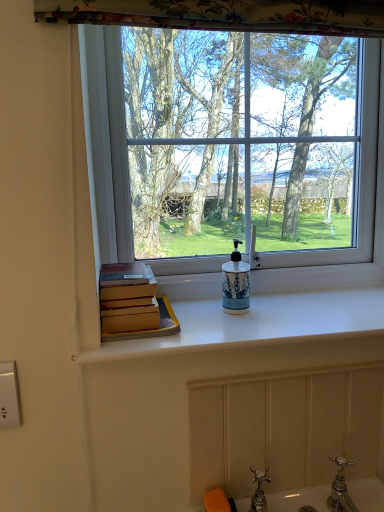
What do you see at coordinates (106, 140) in the screenshot? This screenshot has width=384, height=512. I see `transparent glass window at center` at bounding box center [106, 140].

I want to click on blue and white ceramic soap dispenser at center, so click(x=236, y=283).

What do you see at coordinates (133, 303) in the screenshot?
I see `hardcover books at left` at bounding box center [133, 303].

What do you see at coordinates (9, 396) in the screenshot?
I see `white plastic electric outlet at lower left` at bounding box center [9, 396].

Find the location of a particular element. This screenshot has width=384, height=512. transparent glass window at center is located at coordinates (106, 140).

Considering the sizes of white glossy counter top at center and transparent glass window at center in the image, is white glossy counter top at center bigger or smaller than transparent glass window at center?

Clearly, white glossy counter top at center is smaller in size than transparent glass window at center.

What's the angular difference between white glossy counter top at center and transparent glass window at center's facing directions?

The angular difference between white glossy counter top at center and transparent glass window at center is 0.00143 degrees.

Is white glossy counter top at center further to the viewer compared to transparent glass window at center?

No, it is in front of transparent glass window at center.

Which point is more forward, (153, 308) or (226, 279)?

The point (153, 308) is closer.

Does hardcover books at left have a lesser height compared to blue and white ceramic soap dispenser at center?

Yes, hardcover books at left is shorter than blue and white ceramic soap dispenser at center.

From the image's perspective, is hardcover books at left positioned above or below blue and white ceramic soap dispenser at center?

From the image's perspective, hardcover books at left appears below blue and white ceramic soap dispenser at center.

How distant is white plastic electric outlet at lower left from white glossy counter top at center?

The distance of white plastic electric outlet at lower left from white glossy counter top at center is 22.58 inches.

Which of these two, white plastic electric outlet at lower left or white glossy counter top at center, stands shorter?

Standing shorter between the two is white glossy counter top at center.

Is white plastic electric outlet at lower left not within white glossy counter top at center?

white plastic electric outlet at lower left is positioned outside white glossy counter top at center.

Which of these two, white plastic electric outlet at lower left or white glossy counter top at center, is bigger?

With larger size is white glossy counter top at center.

Is blue and white ceramic soap dispenser at center positioned behind hardcover books at left?

Yes, blue and white ceramic soap dispenser at center is further from the camera.

Considering the relative positions of blue and white ceramic soap dispenser at center and hardcover books at left in the image provided, is blue and white ceramic soap dispenser at center to the right of hardcover books at left from the viewer's perspective?

Yes, blue and white ceramic soap dispenser at center is to the right of hardcover books at left.

Which is behind, point (244, 289) or point (107, 330)?

The point (244, 289) is more distant.

Is blue and white ceramic soap dispenser at center looking in the opposite direction of hardcover books at left?

blue and white ceramic soap dispenser at center does not have its back to hardcover books at left.

Is transparent glass window at center taller or shorter than white plastic electric outlet at lower left?

Clearly, transparent glass window at center is taller compared to white plastic electric outlet at lower left.

Does transparent glass window at center have a greater width compared to white plastic electric outlet at lower left?

Correct, the width of transparent glass window at center exceeds that of white plastic electric outlet at lower left.

Could white plastic electric outlet at lower left be considered to be inside transparent glass window at center?

No, white plastic electric outlet at lower left is not surrounded by transparent glass window at center.

Which is closer to the camera, (x=173, y=330) or (x=113, y=257)?

Positioned in front is point (x=173, y=330).

Are hardcover books at left and transparent glass window at center located far from each other?

No, hardcover books at left is not far away from transparent glass window at center.

From the image's perspective, between hardcover books at left and transparent glass window at center, which one is located above?

transparent glass window at center is shown above in the image.

Is hardcover books at left at the left side of transparent glass window at center?

Yes.

Measure the distance between transparent glass window at center and hardcover books at left.

transparent glass window at center is 11.02 inches from hardcover books at left.

Could you tell me if transparent glass window at center is turned towards hardcover books at left?

Yes, transparent glass window at center is oriented towards hardcover books at left.

This screenshot has height=512, width=384. In order to click on book in front of the transparent glass window at center in this screenshot , I will do `click(133, 303)`.

Does transparent glass window at center have a smaller size compared to hardcover books at left?

Actually, transparent glass window at center might be larger than hardcover books at left.

The width and height of the screenshot is (384, 512). I want to click on counter top directly beneath the transparent glass window at center (from a real-world perspective), so click(x=259, y=324).

Identify the location of soap dispenser located above the hardcover books at left (from the image's perspective). (236, 283).

When comparing their distances from hardcover books at left, does white plastic electric outlet at lower left or white glossy counter top at center seem further?

white plastic electric outlet at lower left is positioned further to the anchor hardcover books at left.

Considering their positions, is white plastic electric outlet at lower left positioned closer to white glossy counter top at center than transparent glass window at center?

The object closer to white glossy counter top at center is transparent glass window at center.

Looking at this image, when comparing their distances from transparent glass window at center, does white plastic electric outlet at lower left or hardcover books at left seem further?

Based on the image, white plastic electric outlet at lower left appears to be further to transparent glass window at center.

Based on their spatial positions, is hardcover books at left or blue and white ceramic soap dispenser at center closer to white plastic electric outlet at lower left?

Among the two, hardcover books at left is located nearer to white plastic electric outlet at lower left.

Based on their spatial positions, is transparent glass window at center or hardcover books at left further from blue and white ceramic soap dispenser at center?

Based on the image, transparent glass window at center appears to be further to blue and white ceramic soap dispenser at center.

Based on their spatial positions, is white glossy counter top at center or white plastic electric outlet at lower left further from hardcover books at left?

Among the two, white plastic electric outlet at lower left is located further to hardcover books at left.

Considering their positions, is white glossy counter top at center positioned further to white plastic electric outlet at lower left than transparent glass window at center?

transparent glass window at center lies further to white plastic electric outlet at lower left than the other object.

When comparing their distances from blue and white ceramic soap dispenser at center, does transparent glass window at center or white plastic electric outlet at lower left seem further?

Based on the image, white plastic electric outlet at lower left appears to be further to blue and white ceramic soap dispenser at center.

Where is `soap dispenser between white plastic electric outlet at lower left and white glossy counter top at center in the horizontal direction`? soap dispenser between white plastic electric outlet at lower left and white glossy counter top at center in the horizontal direction is located at coordinates (236, 283).

You are a GUI agent. You are given a task and a screenshot of the screen. Output one action in this format:
    pyautogui.click(x=<x>, y=<y>)
    Task: Click on the soap dispenser between transparent glass window at center and white glossy counter top at center in the up-down direction
    The width and height of the screenshot is (384, 512).
    Given the screenshot: What is the action you would take?
    pyautogui.click(x=236, y=283)

At what (x,y) coordinates should I click in order to perform the action: click on book located between white plastic electric outlet at lower left and transparent glass window at center in the left-right direction. Please return your answer as a coordinate pair (x, y). Image resolution: width=384 pixels, height=512 pixels. Looking at the image, I should click on (133, 303).

Locate an element on the screen. book between white plastic electric outlet at lower left and blue and white ceramic soap dispenser at center is located at coordinates (133, 303).